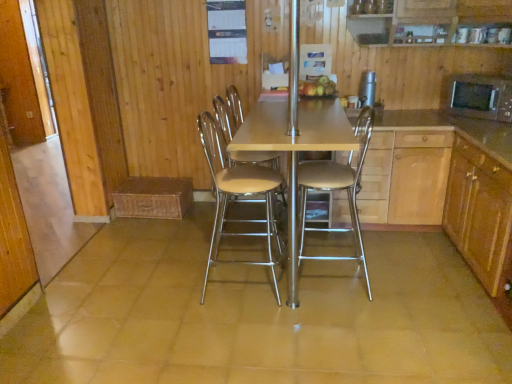
Find the location of a particular element. vacant space positioned to the left of beige leather chair at center, the 2th chair in the right-to-left sequence is located at coordinates (175, 290).